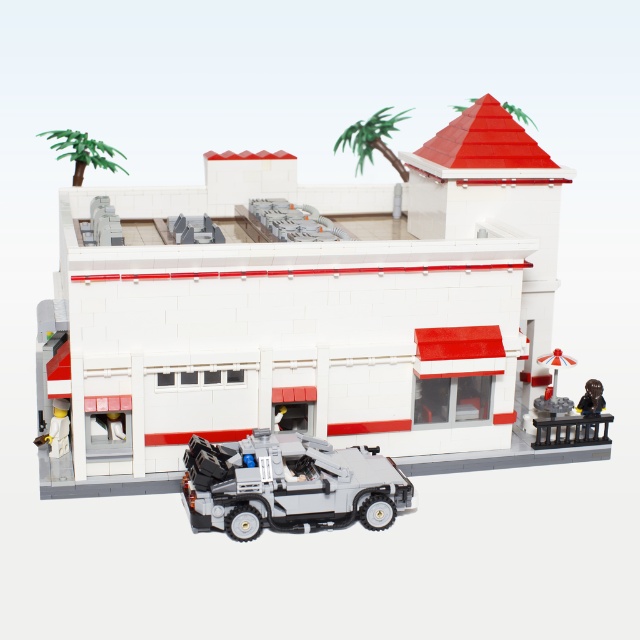
Question: Which object is the farthest from the gray plastic car at lower center?

Choices:
 (A) green leafy palm tree at upper center
 (B) green plastic palm tree at upper left
 (C) white matte building at center

Answer: (A)

Question: Which object is closer to the camera taking this photo?

Choices:
 (A) green leafy palm tree at upper center
 (B) white matte building at center
 (C) green plastic palm tree at upper left

Answer: (B)

Question: Is green leafy palm tree at upper center smaller than green plastic palm tree at upper left?

Choices:
 (A) yes
 (B) no

Answer: (A)

Question: Is gray plastic car at lower center above green plastic palm tree at upper left?

Choices:
 (A) no
 (B) yes

Answer: (A)

Question: From the image, what is the correct spatial relationship of gray plastic car at lower center in relation to green leafy palm tree at upper center?

Choices:
 (A) left
 (B) right

Answer: (A)

Question: Which point is farther to the camera?

Choices:
 (A) (195, 458)
 (B) (65, 152)

Answer: (B)